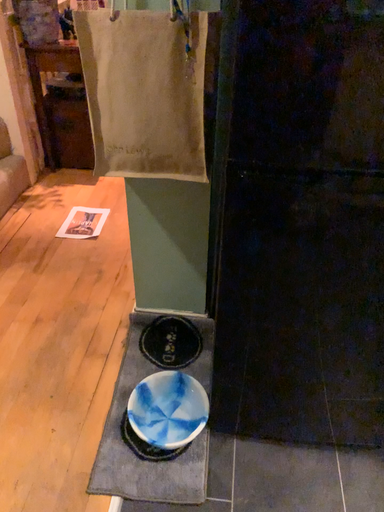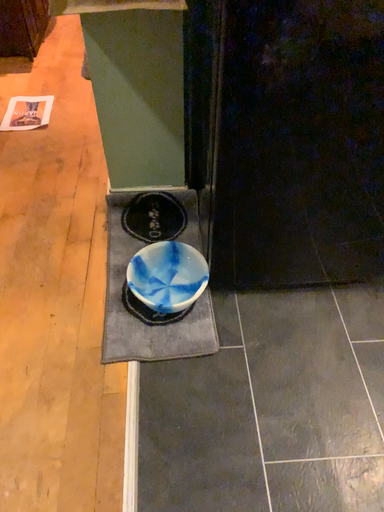
Question: How did the camera likely rotate when shooting the video?

Choices:
 (A) rotated left
 (B) rotated right

Answer: (B)